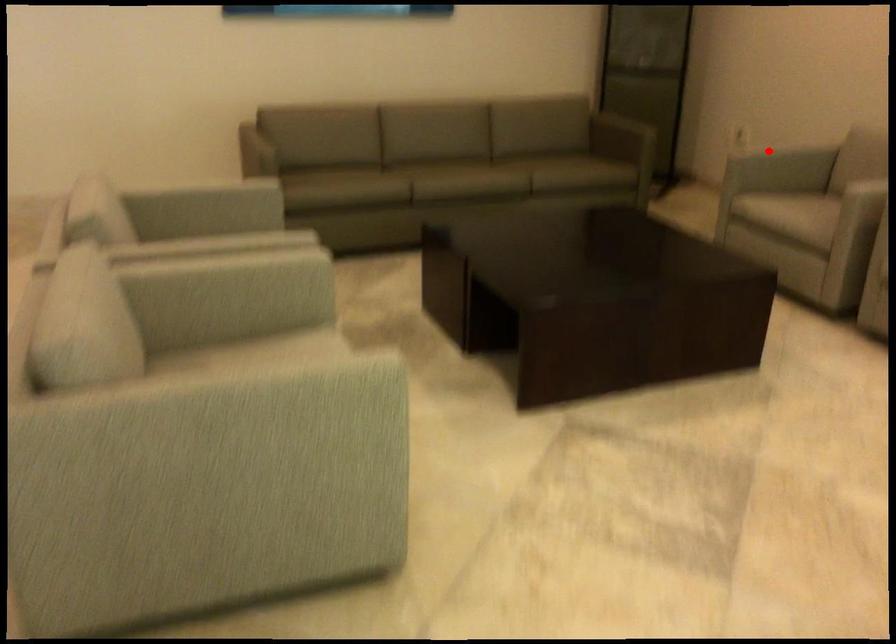
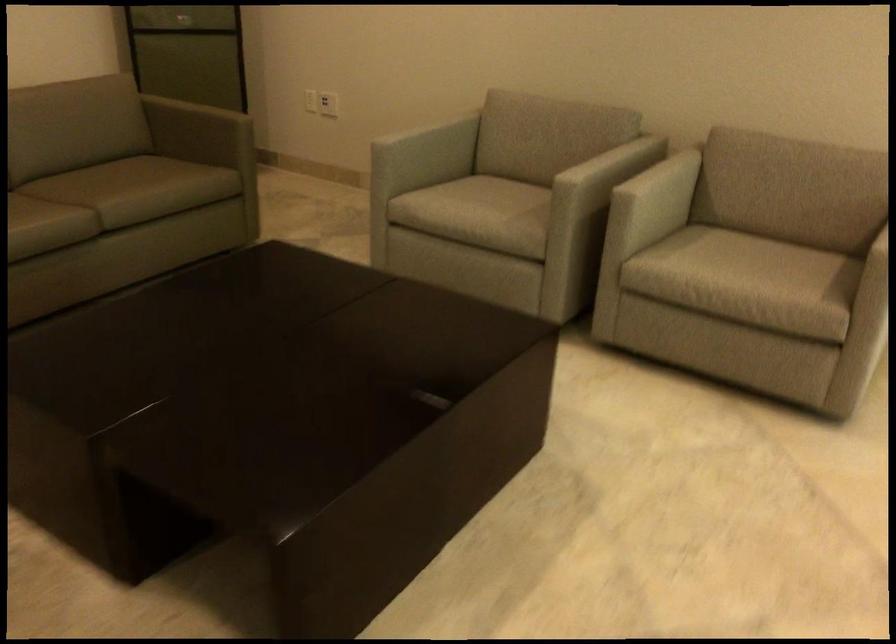
Where in the second image is the point corresponding to the highlighted location from the first image?

(423, 127)